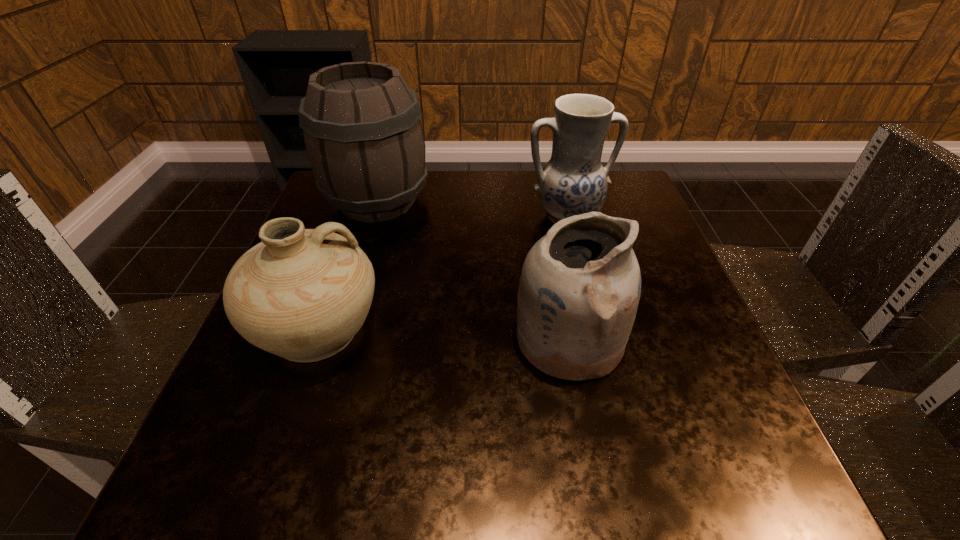
Identify the location of wine bucket. [364, 141].

In order to click on the farthest pottery in this screenshot , I will do `click(573, 182)`.

This screenshot has height=540, width=960. In order to click on the leftmost pottery in this screenshot , I will do click(302, 294).

Locate an element on the screen. The height and width of the screenshot is (540, 960). vacant space located 0.230m on the right of the wine bucket is located at coordinates (525, 201).

You are a GUI agent. You are given a task and a screenshot of the screen. Output one action in this format:
    pyautogui.click(x=<x>, y=<y>)
    Task: Click on the free spot located 0.310m on the front of the farthest pottery
    The height and width of the screenshot is (540, 960).
    Given the screenshot: What is the action you would take?
    pyautogui.click(x=600, y=348)

The height and width of the screenshot is (540, 960). Find the location of `vacant space located on the front of the leftmost pottery`. vacant space located on the front of the leftmost pottery is located at coordinates (259, 497).

You are a GUI agent. You are given a task and a screenshot of the screen. Output one action in this format:
    pyautogui.click(x=<x>, y=<y>)
    Task: Click on the wine bucket that is at the far edge
    Image resolution: width=960 pixels, height=540 pixels.
    Given the screenshot: What is the action you would take?
    pyautogui.click(x=364, y=141)

Where is `pottery situated at the far edge`? pottery situated at the far edge is located at coordinates (573, 182).

The width and height of the screenshot is (960, 540). I want to click on wine bucket present at the left edge, so click(364, 141).

Find the location of a particular element. pottery located at the left edge is located at coordinates (302, 294).